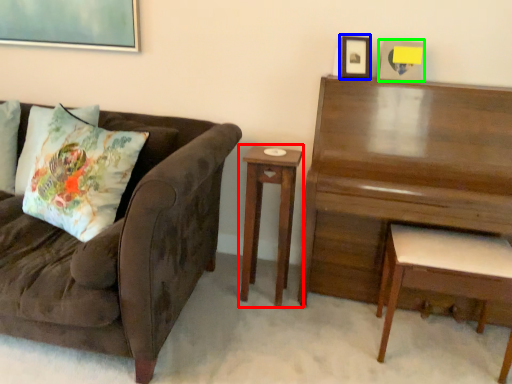
Question: Based on their relative distances, which object is nearer to nightstand (highlighted by a red box)? Choose from picture frame (highlighted by a blue box) and picture frame (highlighted by a green box).

Choices:
 (A) picture frame
 (B) picture frame

Answer: (A)